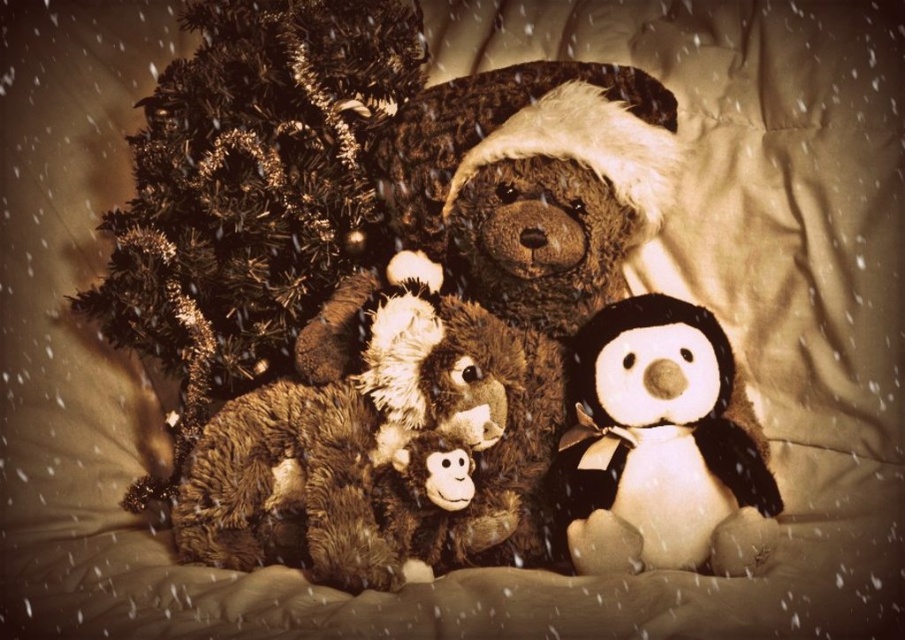
Based on the coordinates provided in the description, where is the fuzzy brown teddy bear at center located in the image?

The fuzzy brown teddy bear at center is located at coordinates point (443, 333).

In the cozy indoor scene with a warm, sepia tone, there are two main stuffed animals at the center. The fuzzy brown teddy bear at center and the white plush penguin at center. Which one is positioned to the left?

The fuzzy brown teddy bear at center is to the left of the white plush penguin at center.

Looking at this image, you are looking at the image and want to determine which of the two points, point 1 at coordinates point (532, 188) or point 2 at coordinates point (551, 472), is closer to you. Based on the scene description, which point is nearer?

Point 1 at coordinates point (532, 188) is closer to the camera than point 2 at coordinates point (551, 472).